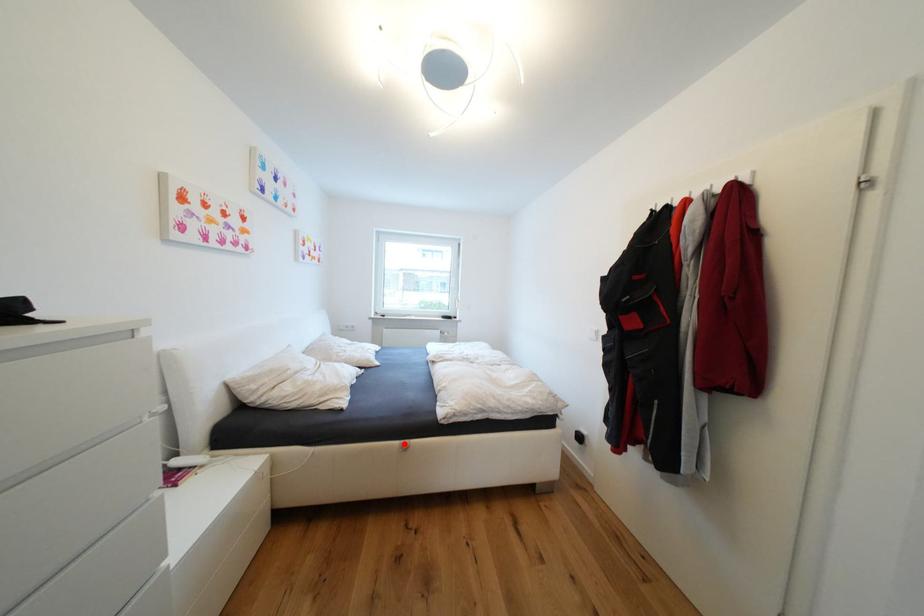
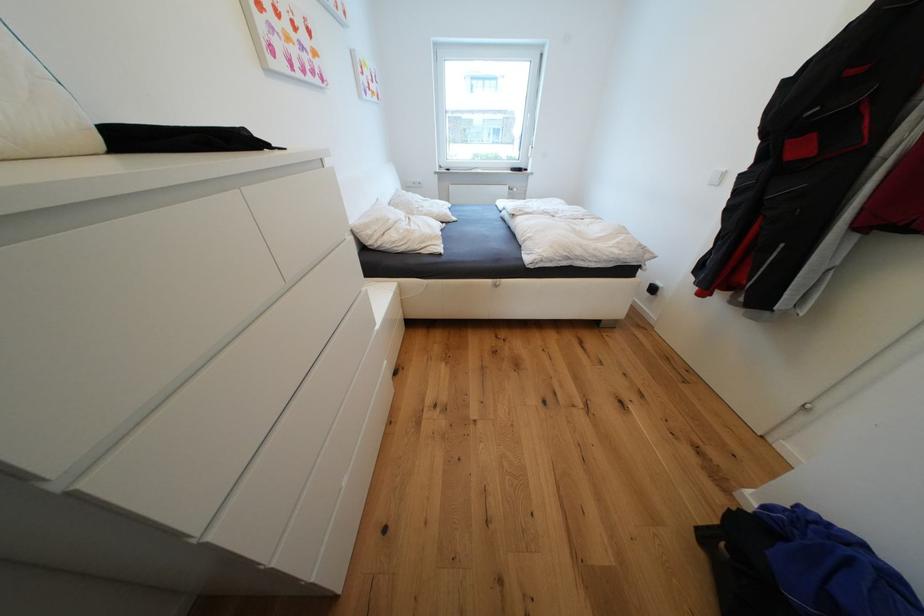
Question: I am providing you with two images of the same scene from different viewpoints. Image1 has a red point marked. In image2, the corresponding 3D location appears at what relative position? Reply with the corresponding letter.

Choices:
 (A) Closer
 (B) Farther

Answer: (A)